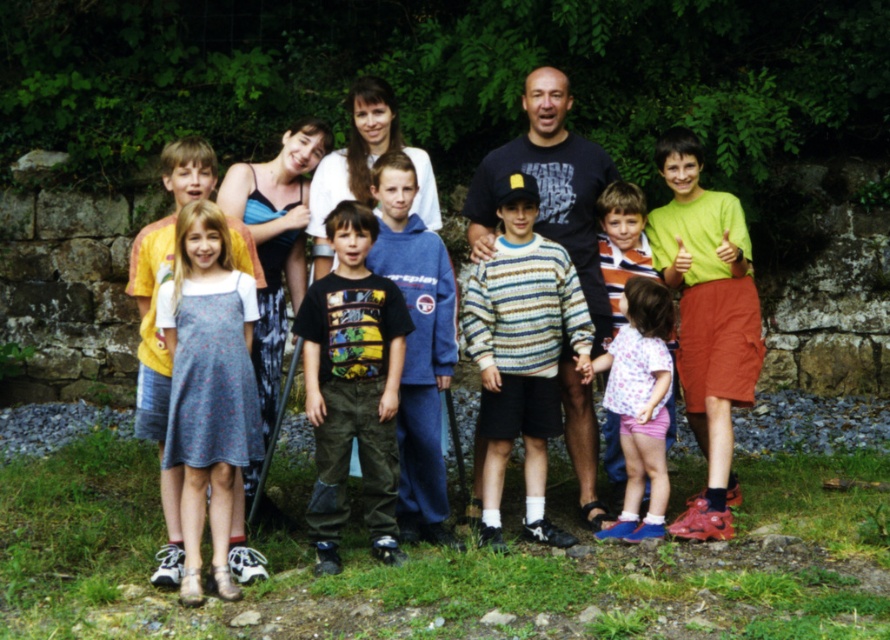
Question: Is floral dress at center smaller than floral fabric dress at lower right?

Choices:
 (A) no
 (B) yes

Answer: (A)

Question: Estimate the real-world distances between objects in this image. Which object is closer to the dark blue t-shirt at center?

Choices:
 (A) floral dress at center
 (B) printed cotton shirt at center
 (C) floral fabric dress at lower right

Answer: (C)

Question: Can you confirm if floral dress at center is positioned to the left of floral fabric dress at lower right?

Choices:
 (A) no
 (B) yes

Answer: (B)

Question: Among these points, which one is farthest from the camera?

Choices:
 (A) (206, 307)
 (B) (654, 445)
 (C) (506, 164)
 (D) (203, 476)

Answer: (C)

Question: Can you confirm if printed cotton shirt at center is positioned to the right of dark blue t-shirt at center?

Choices:
 (A) no
 (B) yes

Answer: (A)

Question: Which of the following is the closest to the observer?

Choices:
 (A) floral dress at center
 (B) printed cotton shirt at center
 (C) dark blue t-shirt at center
 (D) floral fabric dress at lower right

Answer: (A)